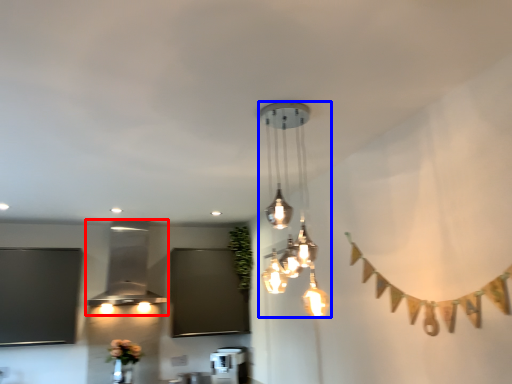
Question: Which object appears farthest to the camera in this image, lamp (highlighted by a red box) or lamp (highlighted by a blue box)?

Choices:
 (A) lamp
 (B) lamp

Answer: (A)